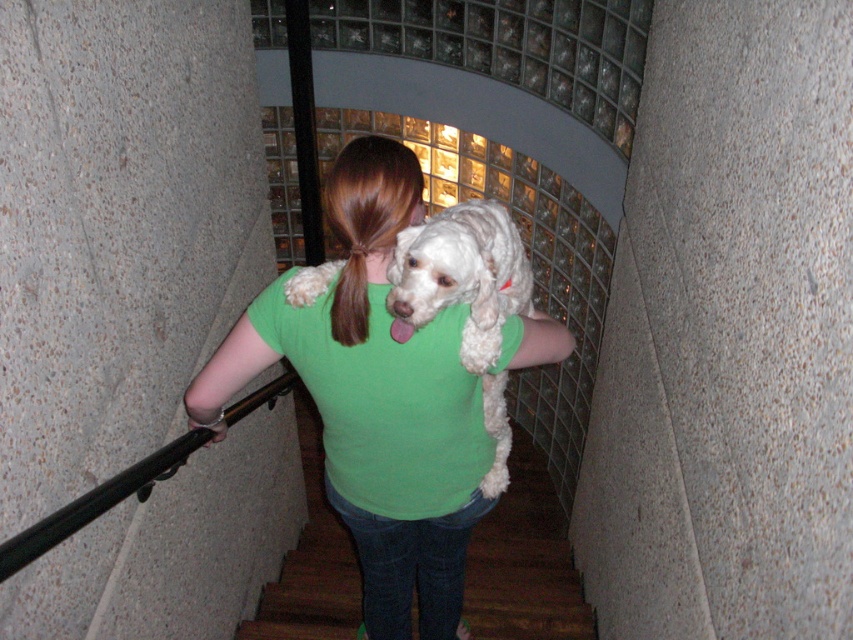
Question: Observing the image, what is the correct spatial positioning of green cotton shirt at center in reference to white fluffy dog at center?

Choices:
 (A) above
 (B) below

Answer: (B)

Question: Is the position of green cotton shirt at center more distant than that of white fluffy dog at center?

Choices:
 (A) yes
 (B) no

Answer: (A)

Question: Where is green cotton shirt at center located in relation to white fluffy dog at center in the image?

Choices:
 (A) right
 (B) left

Answer: (B)

Question: Which of the following is the closest to the observer?

Choices:
 (A) (526, 362)
 (B) (498, 406)

Answer: (A)